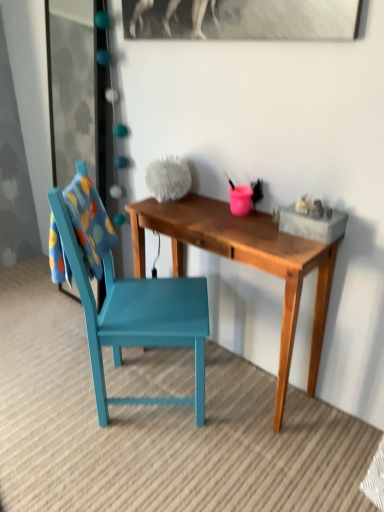
Identify the location of vacant region in front of teal painted wood chair at left. Image resolution: width=384 pixels, height=512 pixels. (142, 466).